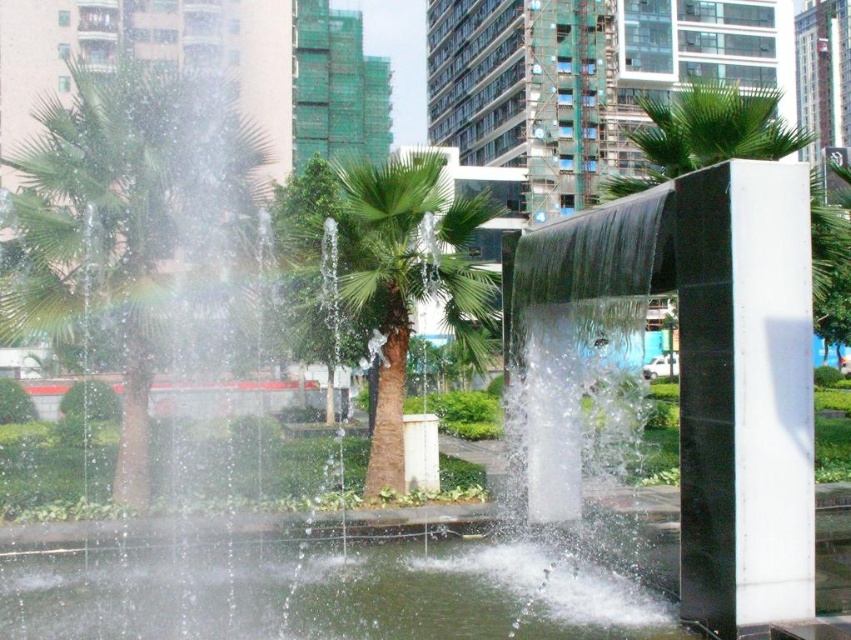
Question: Can you confirm if black polished stone pillar at right is positioned below clear water at center?

Choices:
 (A) no
 (B) yes

Answer: (A)

Question: Which of these objects is positioned farthest from the black polished stone pillar at right?

Choices:
 (A) clear water at center
 (B) green leafy palm tree at center
 (C) green leafy palm tree at left

Answer: (C)

Question: Which of the following is the closest to the observer?

Choices:
 (A) (278, 628)
 (B) (380, 172)
 (C) (140, 506)
 (D) (763, 609)

Answer: (D)

Question: Is clear water at center thinner than green leafy palm tree at center?

Choices:
 (A) no
 (B) yes

Answer: (A)

Question: Which point appears farthest from the camera in this image?

Choices:
 (A) (358, 564)
 (B) (780, 577)
 (C) (427, 280)
 (D) (206, 182)

Answer: (D)

Question: Can you confirm if green leafy palm tree at left is positioned below green leafy palm tree at center?

Choices:
 (A) yes
 (B) no

Answer: (B)